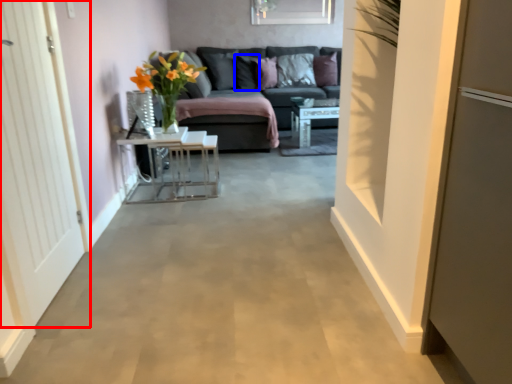
Question: Among these objects, which one is nearest to the camera, door (highlighted by a red box) or pillow (highlighted by a blue box)?

Choices:
 (A) door
 (B) pillow

Answer: (A)